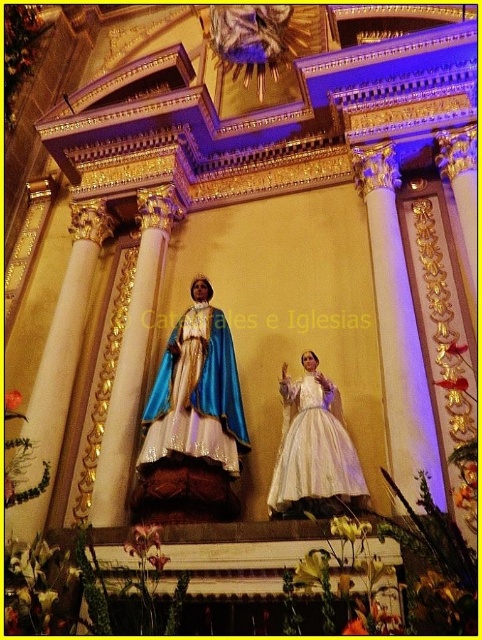
Can you confirm if blue satin dress at center is positioned above white satin dress at center?

Yes.

Does blue satin dress at center lie in front of white satin dress at center?

That is False.

Identify the location of blue satin dress at center. (197, 394).